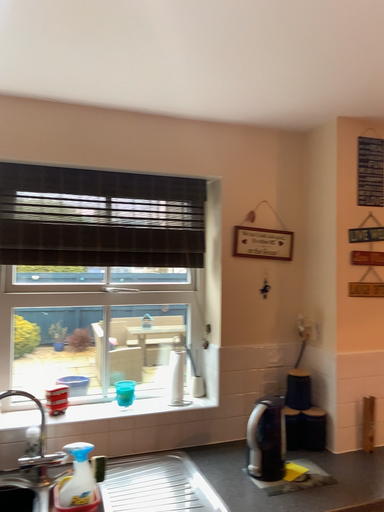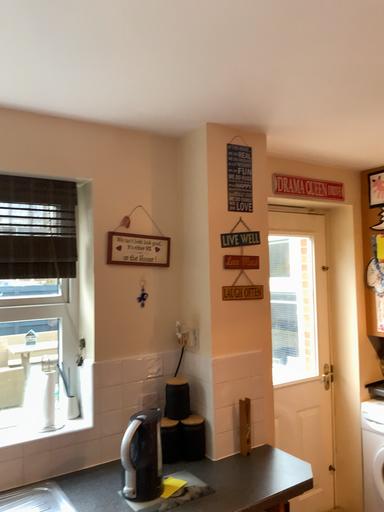
Question: How did the camera likely rotate when shooting the video?

Choices:
 (A) rotated left
 (B) rotated right

Answer: (B)